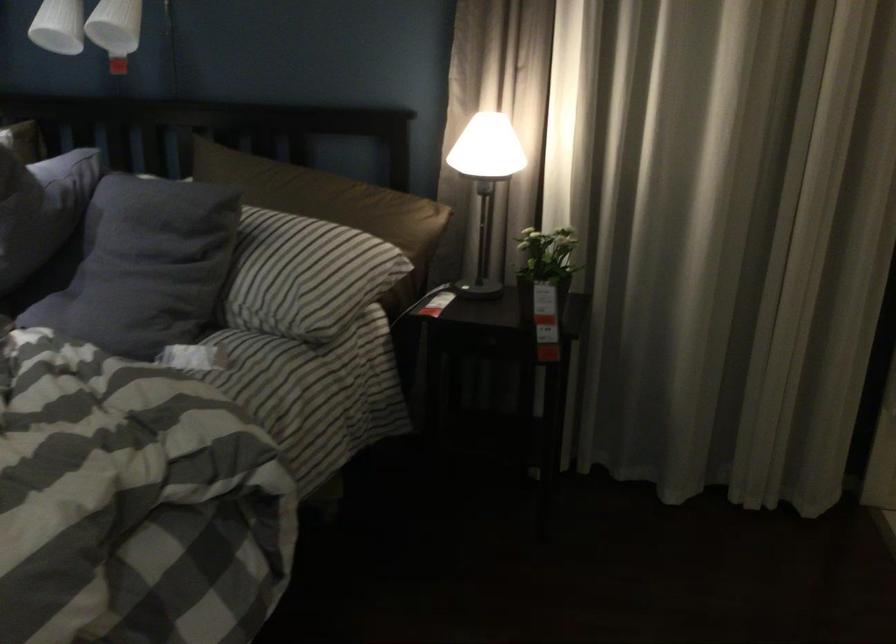
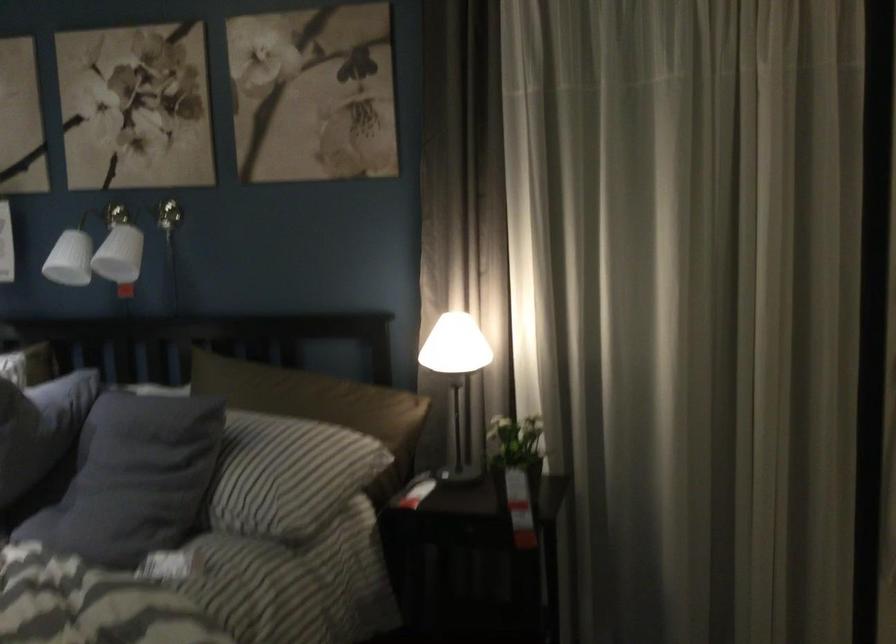
The point at (777, 368) is marked in the first image. Where is the corresponding point in the second image?

(761, 540)